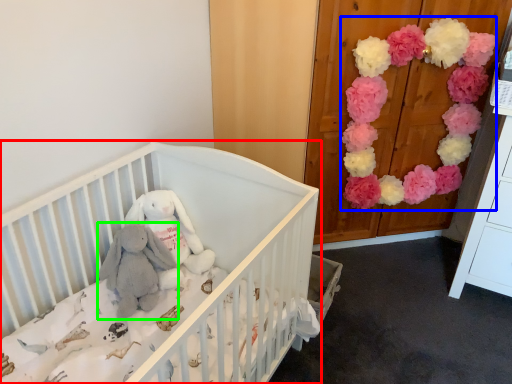
Question: Based on their relative distances, which object is farther from infant bed (highlighted by a red box)? Choose from flower (highlighted by a blue box) and baby elephant (highlighted by a green box).

Choices:
 (A) flower
 (B) baby elephant

Answer: (A)